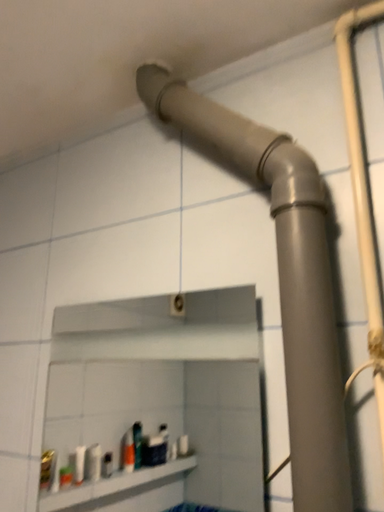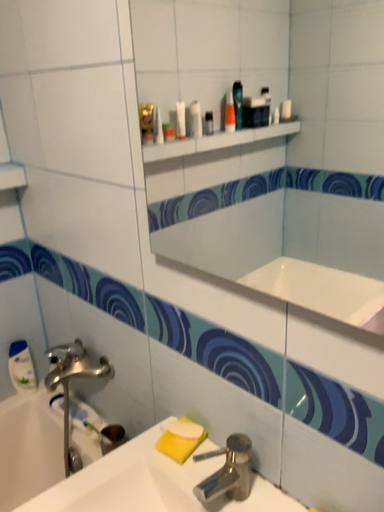
Question: How did the camera likely rotate when shooting the video?

Choices:
 (A) rotated left
 (B) rotated right

Answer: (A)